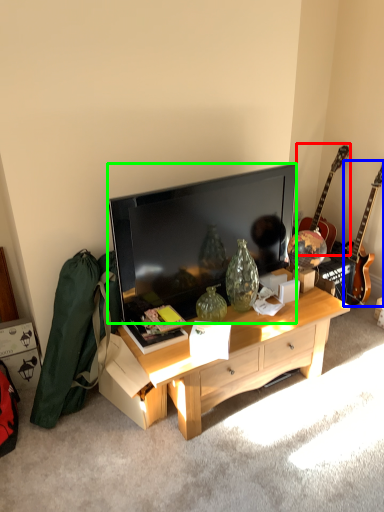
Question: Estimate the real-world distances between objects in this image. Which object is closer to guitar (highlighted by a red box), guitar (highlighted by a blue box) or television (highlighted by a green box)?

Choices:
 (A) guitar
 (B) television

Answer: (A)